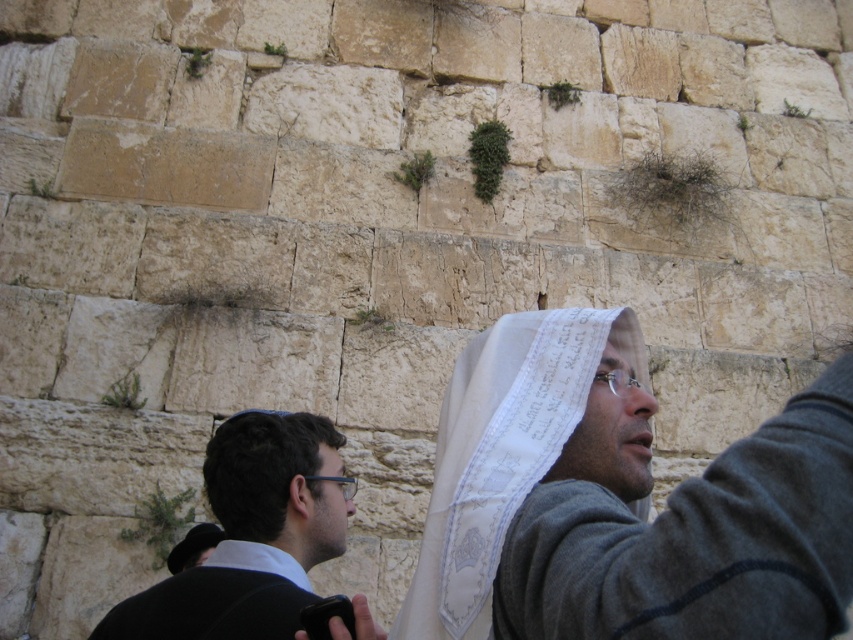
Does white paper at center have a greater width compared to white sheer cloth at center?

Incorrect, white paper at center's width does not surpass white sheer cloth at center's.

Is white paper at center below white sheer cloth at center?

No.

Between point (825, 618) and point (573, 403), which one is positioned behind?

The point (573, 403) is more distant.

Locate an element on the screen. This screenshot has width=853, height=640. white paper at center is located at coordinates click(697, 541).

Is white sheer cloth at center thinner than dark brown hair at lower left?

Incorrect, white sheer cloth at center's width is not less than dark brown hair at lower left's.

Is white sheer cloth at center wider than dark brown hair at lower left?

Correct, the width of white sheer cloth at center exceeds that of dark brown hair at lower left.

Is point (462, 381) positioned in front of point (134, 632)?

No.

Where is `white sheer cloth at center`? Image resolution: width=853 pixels, height=640 pixels. white sheer cloth at center is located at coordinates (502, 452).

Is point (427, 588) positioned behind point (178, 576)?

No, (427, 588) is in front of (178, 576).

Is white sheer cloth at center to the right of black fabric at lower left from the viewer's perspective?

Correct, you'll find white sheer cloth at center to the right of black fabric at lower left.

Is point (476, 470) closer to viewer compared to point (296, 620)?

Yes.

You are a GUI agent. You are given a task and a screenshot of the screen. Output one action in this format:
    pyautogui.click(x=<x>, y=<y>)
    Task: Click on the white sheer cloth at center
    The image size is (853, 640).
    Given the screenshot: What is the action you would take?
    pyautogui.click(x=502, y=452)